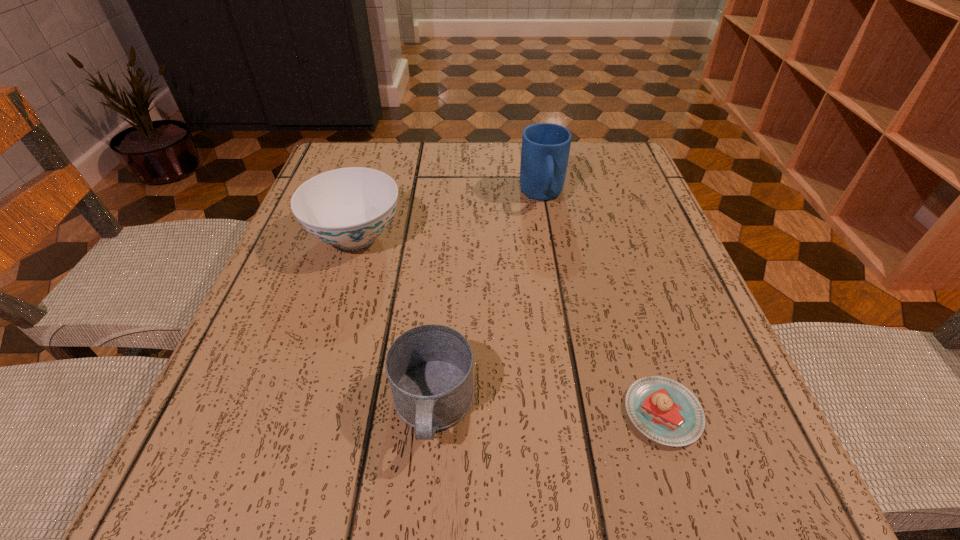
Identify the location of the third object from left to right. (545, 149).

This screenshot has width=960, height=540. In order to click on the farther mug in this screenshot , I will do `click(545, 149)`.

Identify the location of chinaware. [349, 208].

Locate an element on the screen. This screenshot has width=960, height=540. the shorter mug is located at coordinates 430,368.

You are a GUI agent. You are given a task and a screenshot of the screen. Output one action in this format:
    pyautogui.click(x=<x>, y=<y>)
    Task: Click on the third object from right to left
    
    Given the screenshot: What is the action you would take?
    pyautogui.click(x=430, y=368)

You are a GUI agent. You are given a task and a screenshot of the screen. Output one action in this format:
    pyautogui.click(x=<x>, y=<y>)
    Task: Click on the rightmost object
    This screenshot has height=540, width=960.
    Given the screenshot: What is the action you would take?
    pyautogui.click(x=665, y=411)

Find the location of a particular element. Image resolution: width=960 pixels, height=540 pixels. pastry is located at coordinates (665, 411).

This screenshot has width=960, height=540. Find the location of `vacant space located 0.260m on the side of the second object from right to left with the handle`. vacant space located 0.260m on the side of the second object from right to left with the handle is located at coordinates (562, 309).

This screenshot has height=540, width=960. Identify the location of vacant region located on the back of the leftmost object. (374, 177).

You are a GUI agent. You are given a task and a screenshot of the screen. Output one action in this format:
    pyautogui.click(x=<x>, y=<y>)
    Task: Click on the vacant point located 0.380m on the back of the rightmost object
    
    Given the screenshot: What is the action you would take?
    pyautogui.click(x=602, y=220)